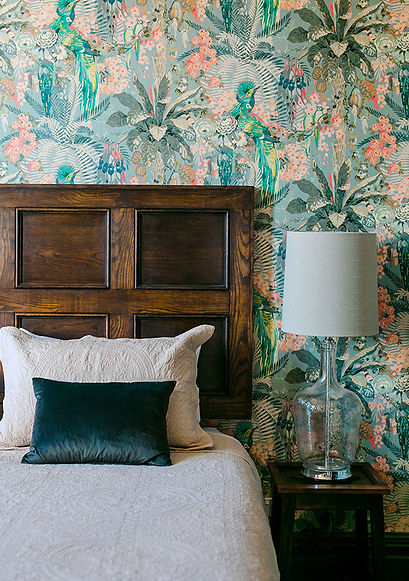
The image size is (409, 581). Identify the location of table. (289, 473).